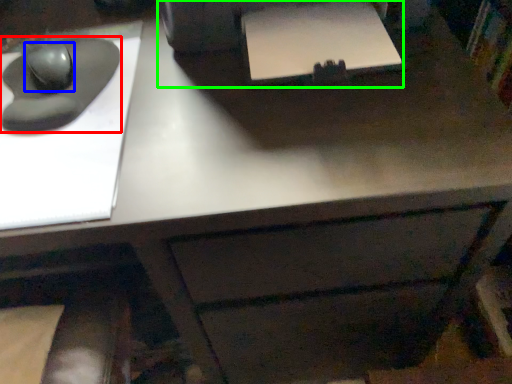
Question: Based on their relative distances, which object is farther from mouse (highlighted by a red box)? Choose from mouse (highlighted by a blue box) and printer (highlighted by a green box).

Choices:
 (A) mouse
 (B) printer

Answer: (B)